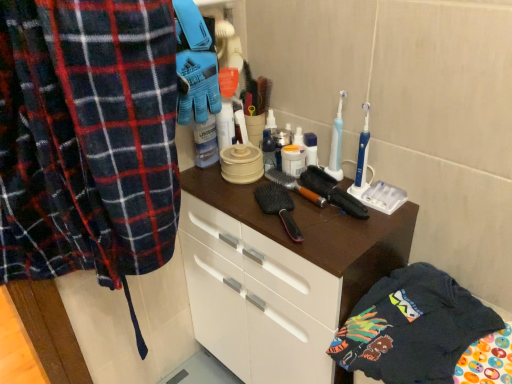
Question: Based on their positions, is black rubber brush at center, the 1th brush when ordered from right to left, located to the left or right of brown matte cabinet at center?

Choices:
 (A) right
 (B) left

Answer: (A)

Question: Is point (330, 178) closer or farther from the camera than point (274, 274)?

Choices:
 (A) farther
 (B) closer

Answer: (A)

Question: Which is nearer to the brown matte cabinet at center?

Choices:
 (A) brown wooden brush at center, arranged as the 1th brush when viewed from the left
 (B) black rubber brush at center, the 2th brush when ordered from left to right
 (C) dark blue cotton t-shirt at lower right

Answer: (C)

Question: Which object is positioned farthest from the brown matte cabinet at center?

Choices:
 (A) black rubber brush at center, the 1th brush when ordered from right to left
 (B) brown wooden brush at center, arranged as the 1th brush when viewed from the left
 (C) dark blue cotton t-shirt at lower right

Answer: (B)